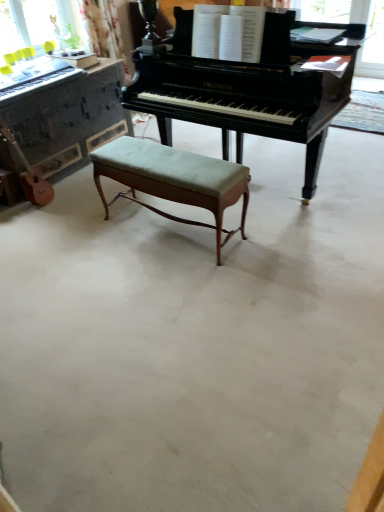
Locate an element on the screen. The height and width of the screenshot is (512, 384). free point in front of green fabric stool at center is located at coordinates (169, 293).